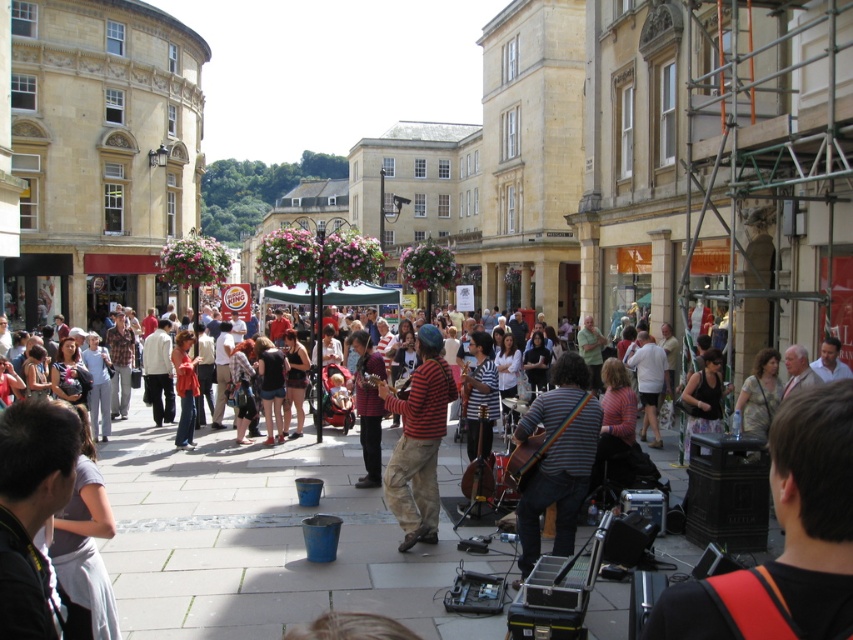
Question: Does striped fabric guitar at center appear on the right side of striped cotton shirt at center?

Choices:
 (A) yes
 (B) no

Answer: (A)

Question: Which point is closer to the camera?

Choices:
 (A) (416, 342)
 (B) (531, 531)

Answer: (B)

Question: In this image, where is striped fabric guitar at center located relative to striped cotton shirt at center?

Choices:
 (A) below
 (B) above

Answer: (A)

Question: Which point is farther to the camera?

Choices:
 (A) (431, 426)
 (B) (564, 410)

Answer: (A)

Question: Can you confirm if striped fabric guitar at center is positioned to the left of striped cotton shirt at center?

Choices:
 (A) yes
 (B) no

Answer: (B)

Question: Which point appears closest to the camera in this image?

Choices:
 (A) (428, 451)
 (B) (553, 460)

Answer: (B)